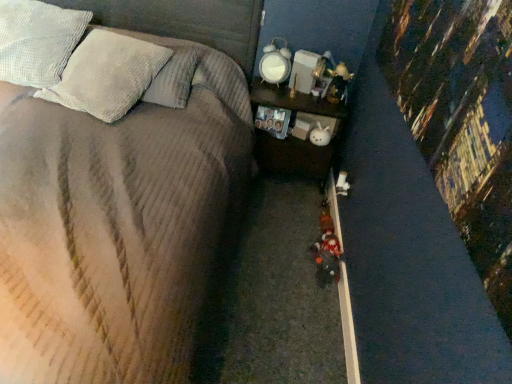
Question: Is corduroy fabric bed at center in front of or behind wooden nightstand at center in the image?

Choices:
 (A) behind
 (B) front

Answer: (B)

Question: Is corduroy fabric bed at center bigger or smaller than wooden nightstand at center?

Choices:
 (A) small
 (B) big

Answer: (B)

Question: Which object is the closest to the white textured pillow at upper left, which is the second pillow in left-to-right order?

Choices:
 (A) white textured pillow at upper left, which is counted as the first pillow, starting from the left
 (B) plush fabric toy at center
 (C) wooden nightstand at center
 (D) corduroy fabric bed at center
 (E) smooth concrete curb at lower right

Answer: (A)

Question: Estimate the real-world distances between objects in this image. Which object is closer to the corduroy fabric bed at center?

Choices:
 (A) white textured pillow at upper left, acting as the 1th pillow starting from the right
 (B) smooth concrete curb at lower right
 (C) wooden nightstand at center
 (D) plush fabric toy at center
 (E) white textured pillow at upper left, which is counted as the first pillow, starting from the left

Answer: (A)